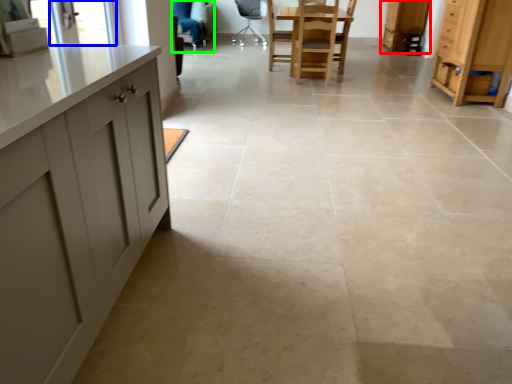
Question: Which object is the farthest from cabinetry (highlighted by a red box)? Choose among these: window screen (highlighted by a blue box) or armchair (highlighted by a green box).

Choices:
 (A) window screen
 (B) armchair

Answer: (A)